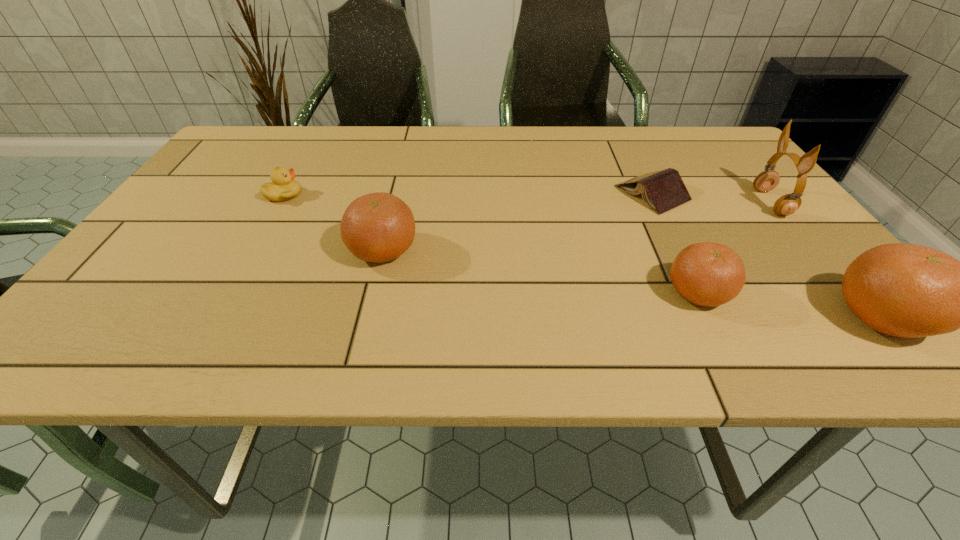
Identify the location of the second object from left to right. Image resolution: width=960 pixels, height=540 pixels. (379, 227).

Identify the location of the fourth shortest object. This screenshot has height=540, width=960. pyautogui.click(x=379, y=227).

You are a GUI agent. You are given a task and a screenshot of the screen. Output one action in this format:
    pyautogui.click(x=<x>, y=<y>)
    Task: Click on the shortest clementine
    The image size is (960, 540).
    Given the screenshot: What is the action you would take?
    pyautogui.click(x=709, y=274)

At what (x,y) coordinates should I click in order to perform the action: click on the second clementine from left to right. Please return your answer as a coordinate pair (x, y). Image resolution: width=960 pixels, height=540 pixels. Looking at the image, I should click on (709, 274).

Identify the location of book. The image size is (960, 540). (663, 190).

At what (x,y) coordinates should I click in order to perform the action: click on the tallest object. Please return your answer as a coordinate pair (x, y). Looking at the image, I should click on (767, 180).

Identify the location of the second shortest object. (283, 187).

Locate an element on the screen. duckling is located at coordinates (283, 187).

Find the location of `free space located on the back of the second tallest clementine`. free space located on the back of the second tallest clementine is located at coordinates (399, 181).

You are a GUI agent. You are given a task and a screenshot of the screen. Output one action in this format:
    pyautogui.click(x=<x>, y=<y>)
    Task: Click on the vacant area located 0.180m on the back of the fourth tallest object
    The height and width of the screenshot is (540, 960).
    Given the screenshot: What is the action you would take?
    pyautogui.click(x=660, y=218)